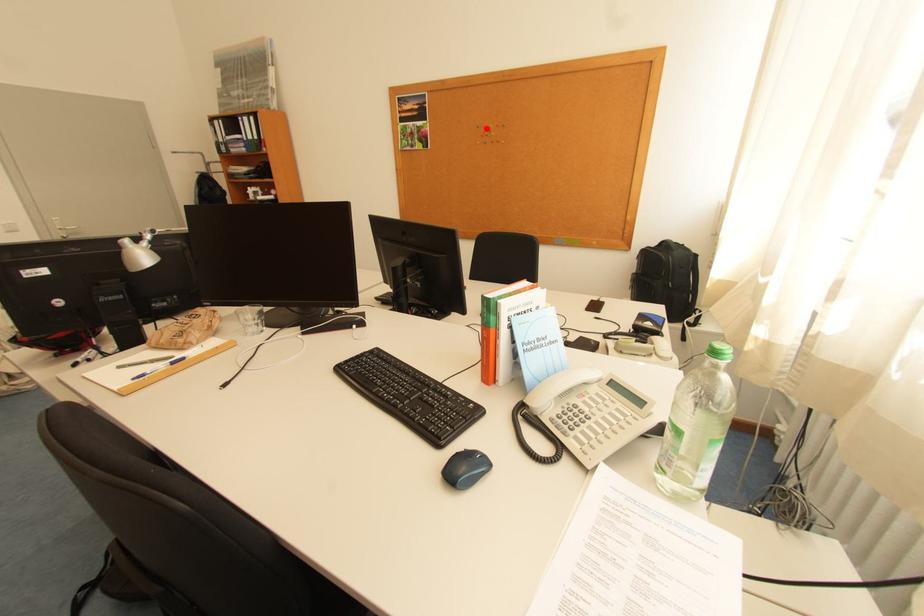
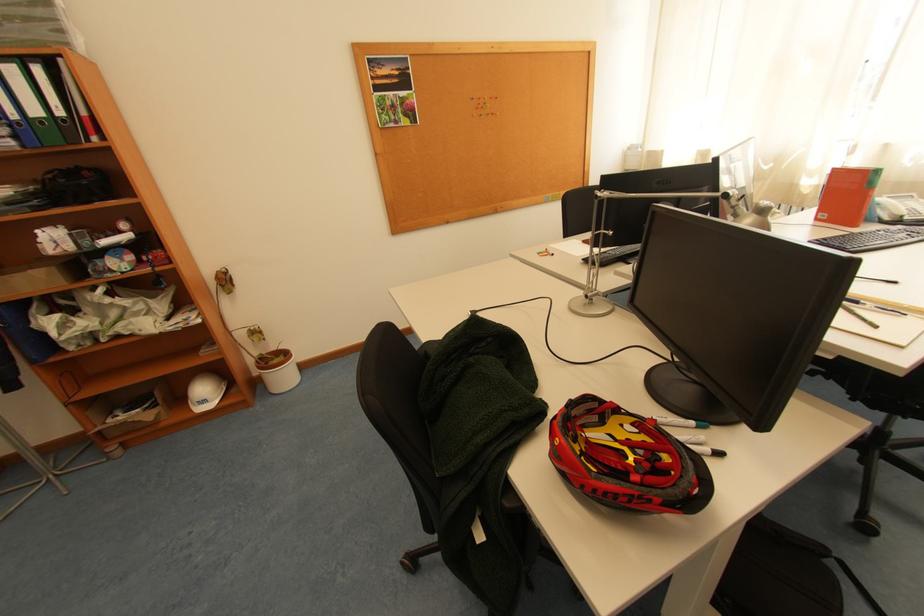
Question: I am providing you with two images of the same scene from different viewpoints. A red point is marked on the first image. Can you still see the location of the red point in image 2?

Choices:
 (A) Yes
 (B) No

Answer: (A)